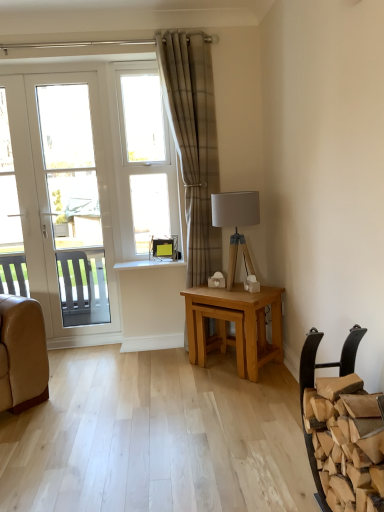
Locate an element on the screen. This screenshot has width=384, height=512. vacant space in front of light oak wooden table at center is located at coordinates (230, 395).